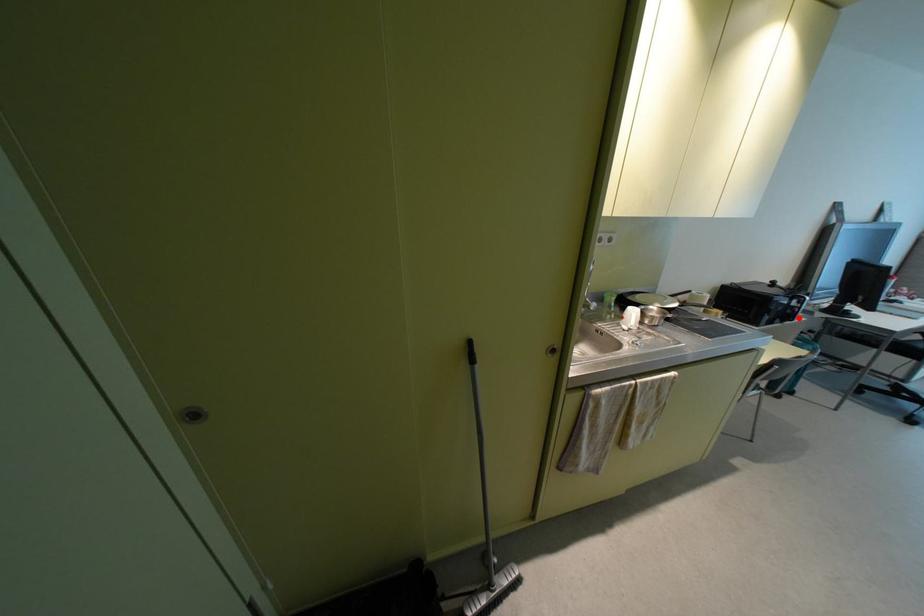
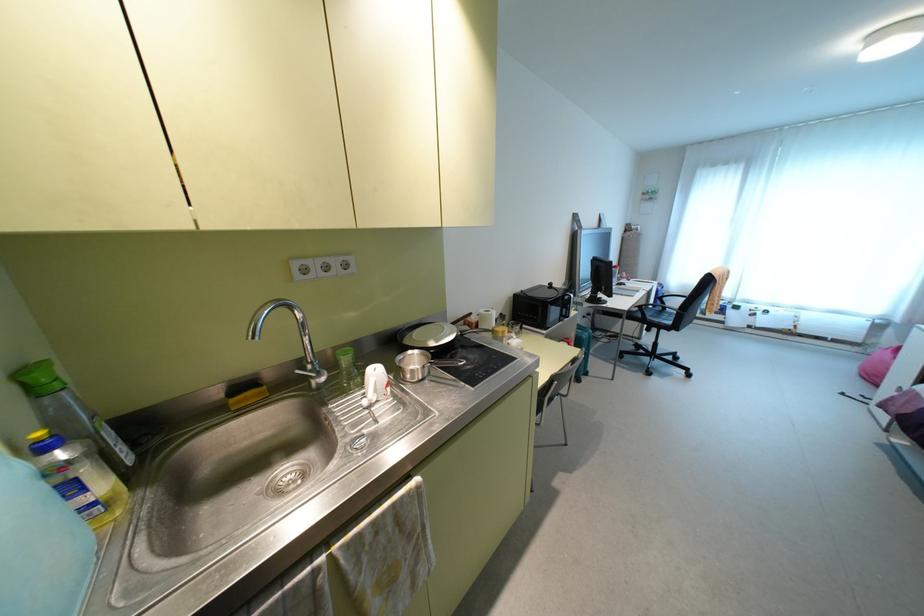
In the second image, find the point that corresponds to the highlighted location in the first image.

(573, 313)